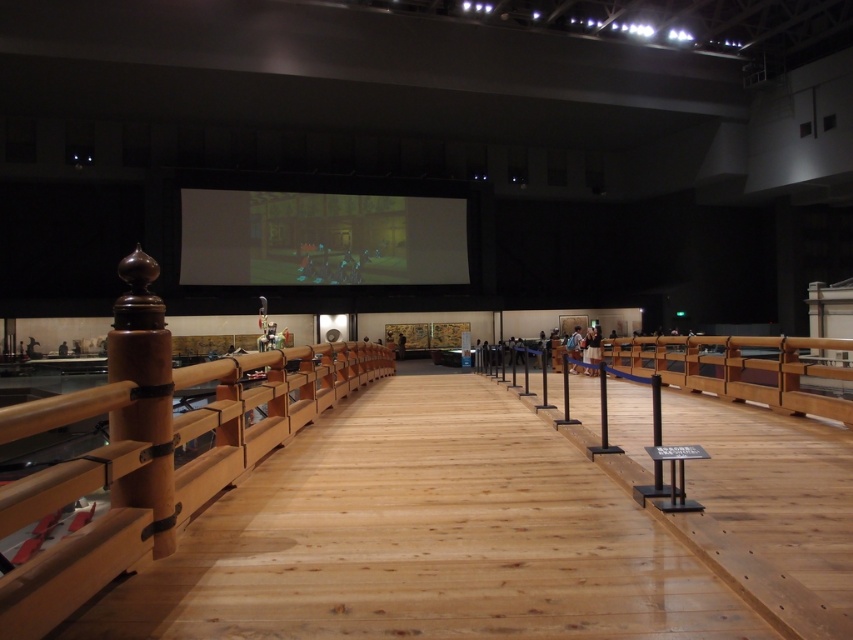
Consider the image. Does natural wood railing at left appear on the right side of matte black screen at center?

Correct, you'll find natural wood railing at left to the right of matte black screen at center.

Who is shorter, natural wood railing at left or matte black screen at center?

natural wood railing at left

Is point (45, 502) positioned after point (451, 220)?

No, (45, 502) is in front of (451, 220).

This screenshot has width=853, height=640. I want to click on natural wood railing at left, so click(154, 465).